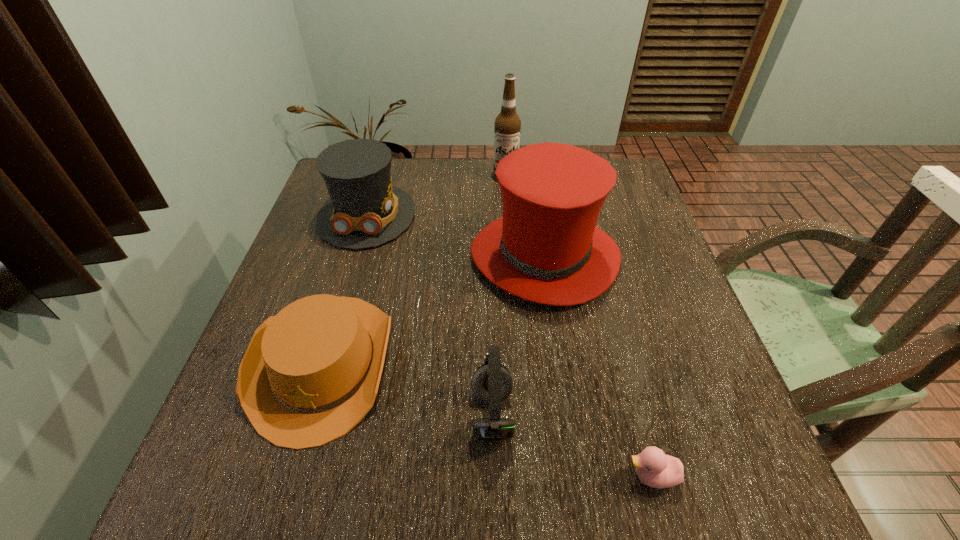
Locate an element on the screen. The width and height of the screenshot is (960, 540). dress hat that is at the far edge is located at coordinates (365, 210).

I want to click on object located at the near edge, so (654, 468).

You are a GUI agent. You are given a task and a screenshot of the screen. Output one action in this format:
    pyautogui.click(x=<x>, y=<y>)
    Task: Click on the dress hat located in the left edge section of the desktop
    Image resolution: width=960 pixels, height=540 pixels.
    Given the screenshot: What is the action you would take?
    pyautogui.click(x=365, y=210)

Find the location of a particular element. cowboy hat that is at the left edge is located at coordinates (310, 374).

Find the location of a particular element. hat located at the right edge is located at coordinates coord(546,248).

Locate an element on the screen. duckling at the right edge is located at coordinates (654, 468).

Where is `object at the far left corner`? This screenshot has width=960, height=540. object at the far left corner is located at coordinates (365, 210).

This screenshot has width=960, height=540. Identify the location of object that is at the near right corner. (654, 468).

You are a GUI agent. You are given a task and a screenshot of the screen. Output one action in this format:
    pyautogui.click(x=<x>, y=<y>)
    Task: Click on the free space at the far edge of the desktop
    This screenshot has width=960, height=540.
    Given the screenshot: What is the action you would take?
    pyautogui.click(x=492, y=195)

This screenshot has width=960, height=540. In order to click on vacant region at the near edge of the desktop in this screenshot , I will do `click(439, 515)`.